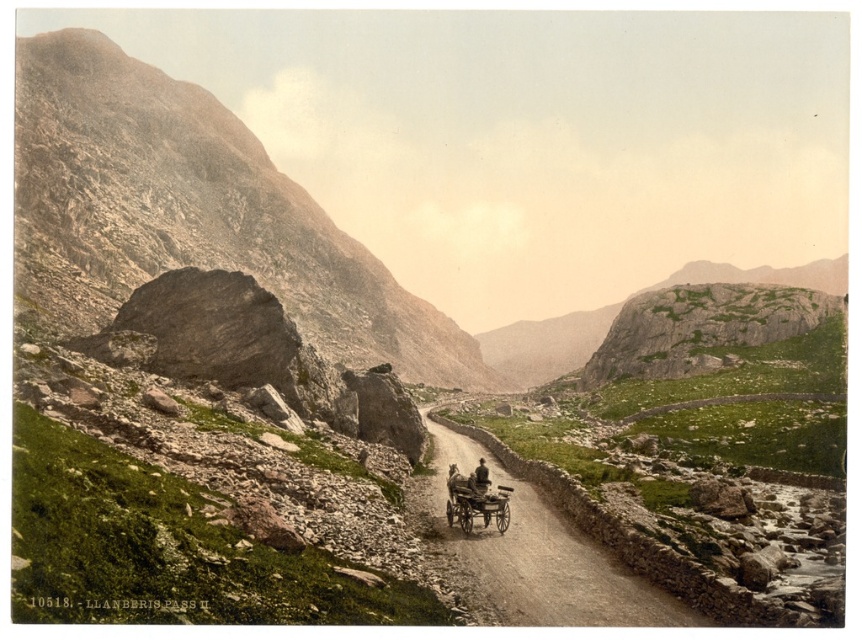
Who is taller, wooden cart at center or brown leather hat at center?

Standing taller between the two is brown leather hat at center.

Is wooden cart at center above brown leather hat at center?

Incorrect, wooden cart at center is not positioned above brown leather hat at center.

Identify the location of wooden cart at center. This screenshot has height=640, width=862. (475, 502).

Locate an element on the screen. The height and width of the screenshot is (640, 862). wooden cart at center is located at coordinates (475, 502).

Measure the distance between rusty rock at left and brown gravel road at center.

rusty rock at left is 483.58 feet away from brown gravel road at center.

Is rusty rock at left shorter than brown gravel road at center?

No, rusty rock at left is not shorter than brown gravel road at center.

Between point (101, 81) and point (531, 572), which one is positioned behind?

Point (101, 81)

The height and width of the screenshot is (640, 862). In order to click on rusty rock at left in this screenshot , I will do `click(192, 212)`.

Does rusty rock at left appear on the right side of wooden cart at center?

No, rusty rock at left is not to the right of wooden cart at center.

Between point (23, 166) and point (475, 497), which one is positioned in front?

Point (475, 497)

Which is in front, point (258, 259) or point (454, 500)?

Point (454, 500) is in front.

Locate an element on the screen. The image size is (862, 640). rusty rock at left is located at coordinates (192, 212).